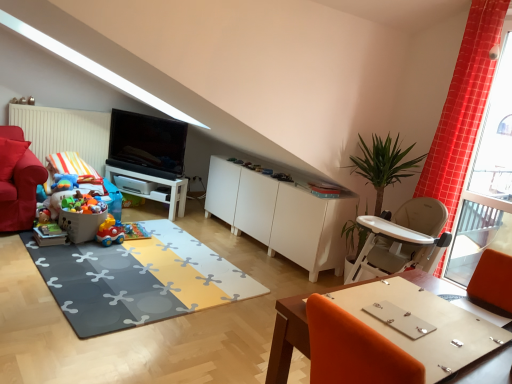
Question: Can you confirm if matte plastic toy at lower left, acting as the fourth toy starting from the top, is positioned to the right of soft rubber mat at center?

Choices:
 (A) no
 (B) yes

Answer: (A)

Question: Could you tell me if matte plastic toy at lower left, positioned as the first toy in bottom-to-top order, is facing soft rubber mat at center?

Choices:
 (A) yes
 (B) no

Answer: (B)

Question: Is matte plastic toy at lower left, positioned as the first toy in bottom-to-top order, wider than soft rubber mat at center?

Choices:
 (A) no
 (B) yes

Answer: (A)

Question: Does matte plastic toy at lower left, acting as the fourth toy starting from the top, touch soft rubber mat at center?

Choices:
 (A) no
 (B) yes

Answer: (A)

Question: Can you confirm if matte plastic toy at lower left, positioned as the first toy in bottom-to-top order, is bigger than soft rubber mat at center?

Choices:
 (A) yes
 (B) no

Answer: (B)

Question: Is matte plastic toy at lower left, acting as the fourth toy starting from the top, further to camera compared to soft rubber mat at center?

Choices:
 (A) yes
 (B) no

Answer: (A)

Question: From a real-world perspective, is red checkered curtain at right on top of soft rubber mat at center?

Choices:
 (A) no
 (B) yes

Answer: (B)

Question: Is red checkered curtain at right aimed at soft rubber mat at center?

Choices:
 (A) no
 (B) yes

Answer: (A)

Question: Is the position of red checkered curtain at right less distant than that of soft rubber mat at center?

Choices:
 (A) yes
 (B) no

Answer: (B)

Question: Is red checkered curtain at right bigger than soft rubber mat at center?

Choices:
 (A) no
 (B) yes

Answer: (B)

Question: From the image's perspective, is red checkered curtain at right on soft rubber mat at center?

Choices:
 (A) yes
 (B) no

Answer: (A)

Question: Is red checkered curtain at right positioned behind soft rubber mat at center?

Choices:
 (A) no
 (B) yes

Answer: (B)

Question: Does soft rubber mat at center have a greater height compared to plastic toy car at lower left, the second toy positioned from the top?

Choices:
 (A) no
 (B) yes

Answer: (A)